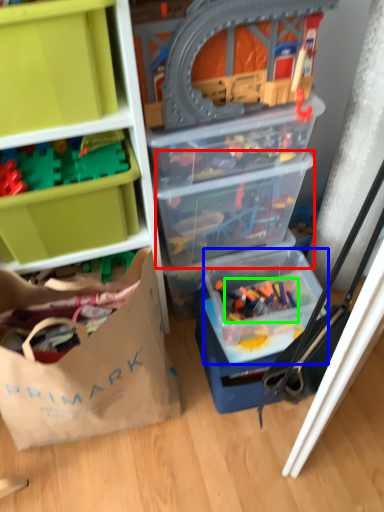
Question: Based on their relative distances, which object is farther from storage box (highlighted by a red box)? Choose from storage box (highlighted by a blue box) and toy (highlighted by a green box).

Choices:
 (A) storage box
 (B) toy

Answer: (B)